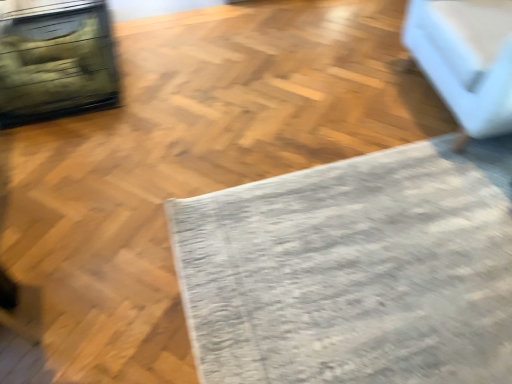
In order to face white fabric couch at upper right, should I rotate leftwards or rightwards?

Turn right approximately 32.204 degrees to face it.

The width and height of the screenshot is (512, 384). I want to click on white fabric couch at upper right, so click(x=466, y=59).

Describe the element at coordinates (466, 59) in the screenshot. I see `white fabric couch at upper right` at that location.

Find the location of `gray textured mat at center`. gray textured mat at center is located at coordinates (354, 270).

Describe the element at coordinates (354, 270) in the screenshot. I see `gray textured mat at center` at that location.

What are the coordinates of `white fabric couch at upper right` in the screenshot? It's located at (466, 59).

Does gray textured mat at center appear on the right side of white fabric couch at upper right?

No.

Does gray textured mat at center lie behind white fabric couch at upper right?

No, gray textured mat at center is in front of white fabric couch at upper right.

Which is closer, (369, 291) or (490, 77)?

Point (369, 291) appears to be closer to the viewer than point (490, 77).

From the image's perspective, is gray textured mat at center located above or below white fabric couch at upper right?

Clearly, from the image's perspective, gray textured mat at center is below white fabric couch at upper right.

From a real-world perspective, which is physically above, gray textured mat at center or white fabric couch at upper right?

white fabric couch at upper right is physically above.

Is gray textured mat at center thinner than white fabric couch at upper right?

In fact, gray textured mat at center might be wider than white fabric couch at upper right.

Between gray textured mat at center and white fabric couch at upper right, which one has less height?

With less height is gray textured mat at center.

Considering the sizes of objects gray textured mat at center and white fabric couch at upper right in the image provided, who is smaller, gray textured mat at center or white fabric couch at upper right?

gray textured mat at center is smaller.

Is gray textured mat at center inside or outside of white fabric couch at upper right?

gray textured mat at center is outside white fabric couch at upper right.

From the picture: Can you see gray textured mat at center touching white fabric couch at upper right?

No, gray textured mat at center is not with white fabric couch at upper right.

Is gray textured mat at center looking in the opposite direction of white fabric couch at upper right?

No, white fabric couch at upper right is not at the back of gray textured mat at center.

This screenshot has height=384, width=512. Identify the location of furniture that appears on the right of gray textured mat at center. (466, 59).

Can you confirm if white fabric couch at upper right is positioned to the right of gray textured mat at center?

Correct, you'll find white fabric couch at upper right to the right of gray textured mat at center.

Looking at this image, is the position of white fabric couch at upper right less distant than that of gray textured mat at center?

No, it is behind gray textured mat at center.

Which is closer to the camera, (502, 13) or (412, 145)?

Point (502, 13) is closer to the camera than point (412, 145).

From the image's perspective, is white fabric couch at upper right over gray textured mat at center?

Yes, from the image's perspective, white fabric couch at upper right is on top of gray textured mat at center.

From a real-world perspective, which is physically below, white fabric couch at upper right or gray textured mat at center?

gray textured mat at center, from a real-world perspective.

Is white fabric couch at upper right wider than gray textured mat at center?

No, white fabric couch at upper right is not wider than gray textured mat at center.

Can you confirm if white fabric couch at upper right is shorter than gray textured mat at center?

In fact, white fabric couch at upper right may be taller than gray textured mat at center.

Based on their sizes in the image, would you say white fabric couch at upper right is bigger or smaller than gray textured mat at center?

white fabric couch at upper right is bigger than gray textured mat at center.

Would you say white fabric couch at upper right contains gray textured mat at center?

That's incorrect, gray textured mat at center is not inside white fabric couch at upper right.

Is white fabric couch at upper right positioned far away from gray textured mat at center?

They are positioned close to each other.

Based on the photo, is white fabric couch at upper right positioned with its back to gray textured mat at center?

white fabric couch at upper right does not have its back to gray textured mat at center.

In order to click on mat in front of the white fabric couch at upper right in this screenshot , I will do `click(354, 270)`.

Identify the location of mat lying in front of the white fabric couch at upper right. (354, 270).

This screenshot has height=384, width=512. What are the coordinates of `furniture above the gray textured mat at center (from a real-world perspective)` in the screenshot? It's located at (466, 59).